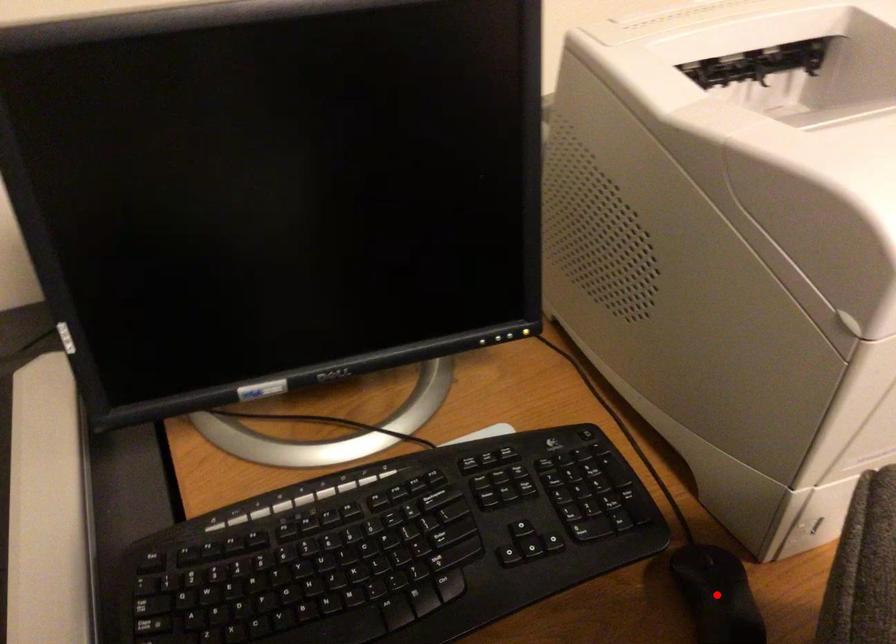
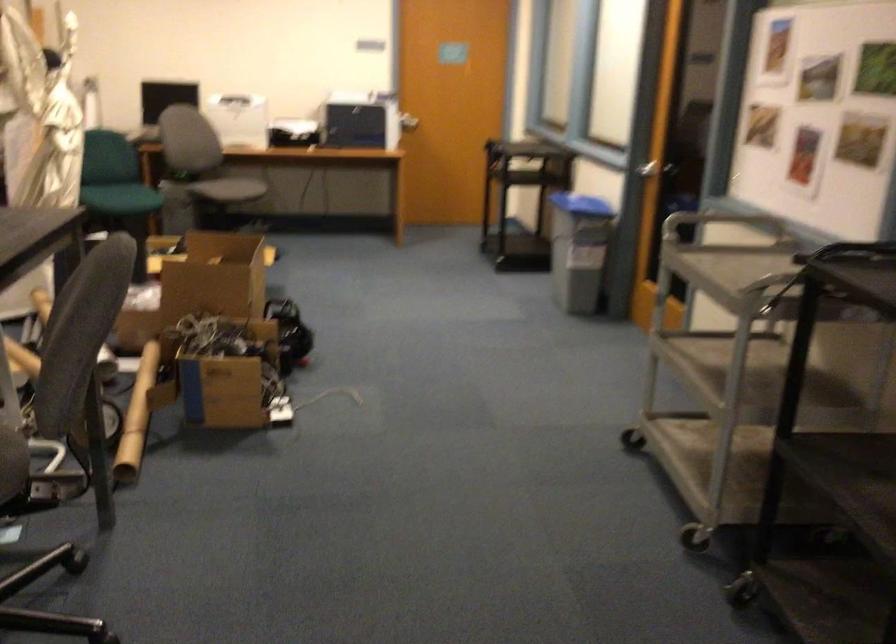
Question: I am providing you with two images of the same scene from different viewpoints. A red point is marked on the first image. At the location where the point appears in image 1, is it still visible in image 2?

Choices:
 (A) Yes
 (B) No

Answer: (B)